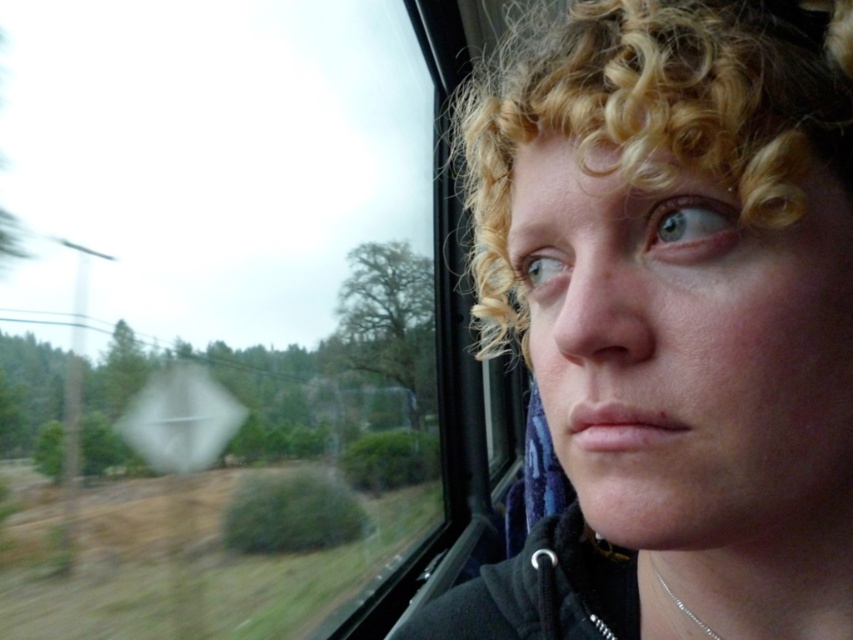
Question: Can you confirm if transparent glass train window at center is smaller than blonde curly hair at upper right?

Choices:
 (A) yes
 (B) no

Answer: (B)

Question: Does transparent glass train window at center appear on the left side of blonde curly hair at upper right?

Choices:
 (A) yes
 (B) no

Answer: (A)

Question: Which object appears farthest from the camera in this image?

Choices:
 (A) transparent glass train window at center
 (B) blonde curly hair at upper right

Answer: (A)

Question: Does transparent glass train window at center appear under blonde curly hair at upper right?

Choices:
 (A) no
 (B) yes

Answer: (B)